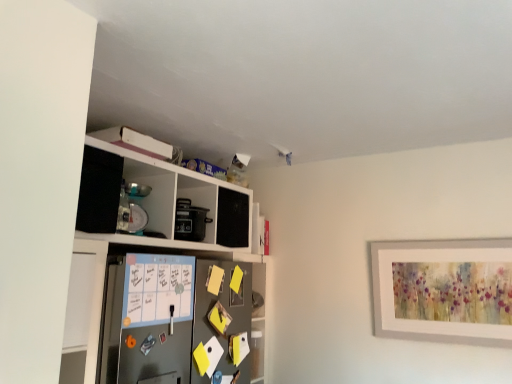
Question: From the image's perspective, relative to metallic gray refrigerator at center, is white matte cabinet at upper left above or below?

Choices:
 (A) above
 (B) below

Answer: (A)

Question: In terms of height, does white matte cabinet at upper left look taller or shorter compared to metallic gray refrigerator at center?

Choices:
 (A) short
 (B) tall

Answer: (B)

Question: Based on their positions, is white matte cabinet at upper left located to the left or right of metallic gray refrigerator at center?

Choices:
 (A) left
 (B) right

Answer: (A)

Question: In terms of height, does metallic gray refrigerator at center look taller or shorter compared to white matte cabinet at upper left?

Choices:
 (A) short
 (B) tall

Answer: (A)

Question: Relative to white matte cabinet at upper left, is metallic gray refrigerator at center in front or behind?

Choices:
 (A) front
 (B) behind

Answer: (B)

Question: From a real-world perspective, relative to white matte cabinet at upper left, is metallic gray refrigerator at center vertically above or below?

Choices:
 (A) above
 (B) below

Answer: (B)

Question: From the image's perspective, is metallic gray refrigerator at center above or below white matte cabinet at upper left?

Choices:
 (A) below
 (B) above

Answer: (A)